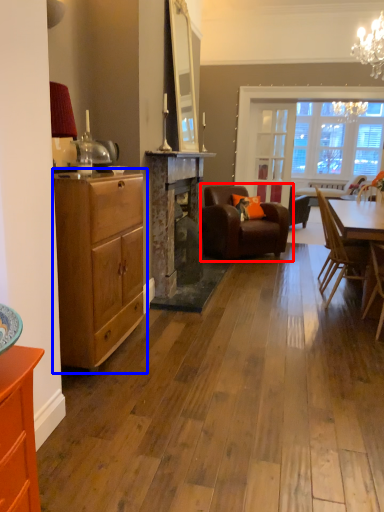
Question: Which of the following is the farthest to the observer, chair (highlighted by a red box) or chest of drawers (highlighted by a blue box)?

Choices:
 (A) chair
 (B) chest of drawers

Answer: (A)